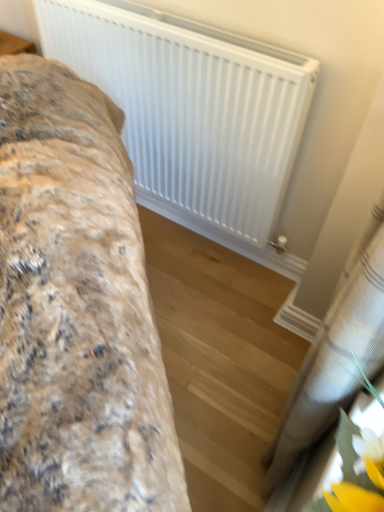
Question: From a real-world perspective, is white sheer curtain at lower right physically located above or below fluffy fabric bed at left?

Choices:
 (A) below
 (B) above

Answer: (B)

Question: Is white sheer curtain at lower right spatially inside fluffy fabric bed at left, or outside of it?

Choices:
 (A) outside
 (B) inside

Answer: (A)

Question: Based on their relative distances, which object is farther from the white matte radiator at upper center?

Choices:
 (A) white sheer curtain at lower right
 (B) fluffy fabric bed at left

Answer: (A)

Question: Which of these objects is positioned closest to the white matte radiator at upper center?

Choices:
 (A) white sheer curtain at lower right
 (B) fluffy fabric bed at left

Answer: (B)